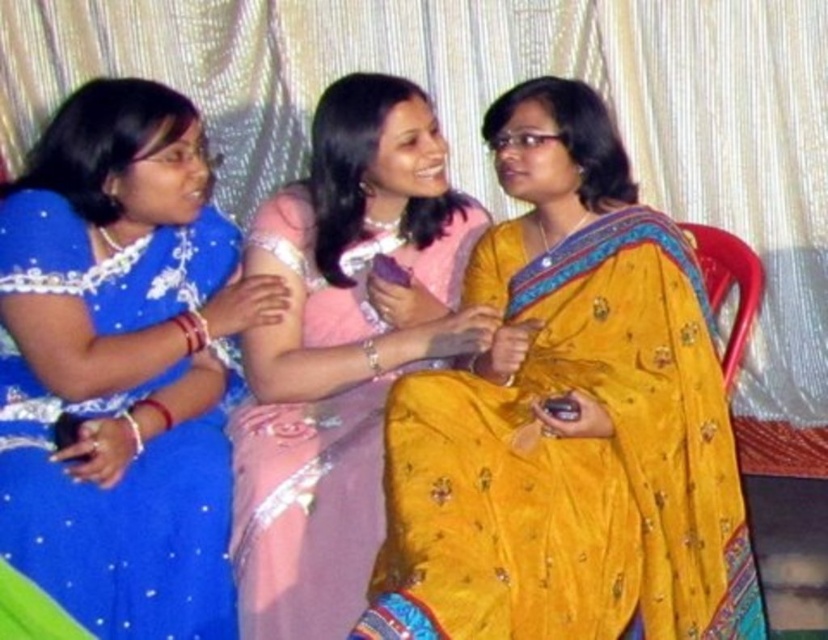
Which is behind, point (171, 108) or point (258, 342)?

Point (258, 342)

Where is `matte blue saree at left`? matte blue saree at left is located at coordinates (118, 372).

Which is above, yellow satin saree at center or plastic chair at right?

plastic chair at right is higher up.

Which of these two, yellow satin saree at center or plastic chair at right, stands taller?

yellow satin saree at center

Who is more distant from viewer, (574, 531) or (725, 378)?

The point (725, 378) is more distant.

At what (x,y) coordinates should I click in order to perform the action: click on yellow satin saree at center. Please return your answer as a coordinate pair (x, y). Image resolution: width=828 pixels, height=640 pixels. Looking at the image, I should click on (567, 420).

Does matte blue saree at left have a greater width compared to plastic chair at right?

Yes.

Does point (159, 144) come farther from viewer compared to point (723, 369)?

No, (159, 144) is closer to viewer.

Where is `matte blue saree at left`? The width and height of the screenshot is (828, 640). matte blue saree at left is located at coordinates (118, 372).